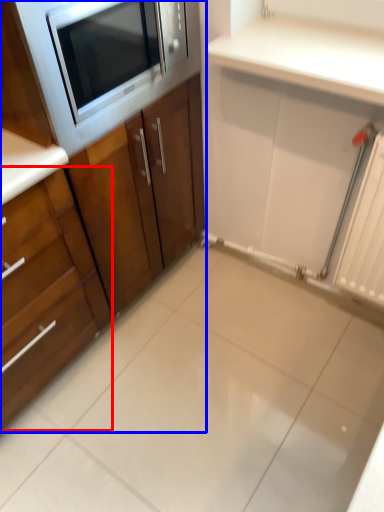
Question: Which of the following is the closest to the observer, cabinetry (highlighted by a red box) or cabinetry (highlighted by a blue box)?

Choices:
 (A) cabinetry
 (B) cabinetry

Answer: (A)